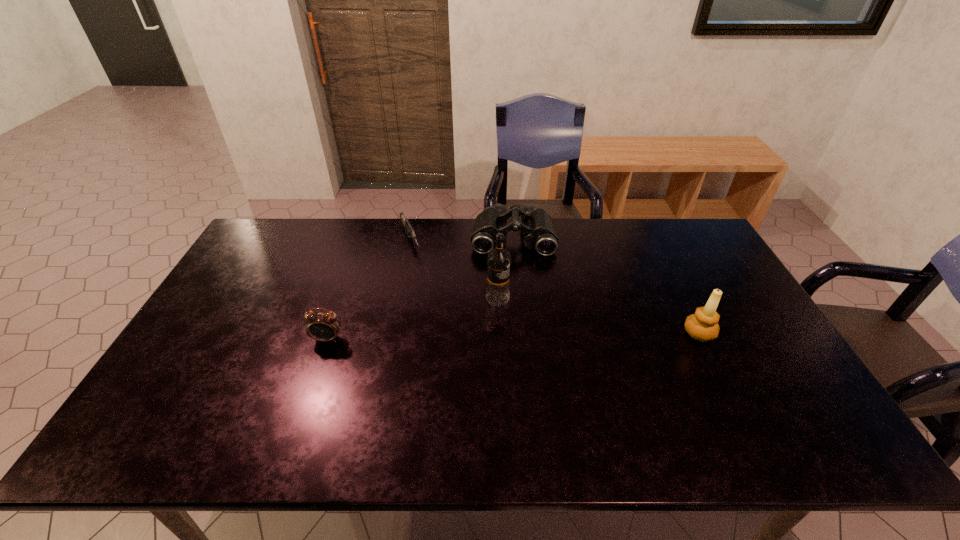
The image size is (960, 540). Identify the location of free space on the desktop that is between the alarm clock and the fourth shortest object and is positioned on the label of the vodka. (559, 335).

Where is `free space on the desktop that is between the leftmost object and the fourth shortest object and is positioned on the front-facing side of the binoculars`? The height and width of the screenshot is (540, 960). free space on the desktop that is between the leftmost object and the fourth shortest object and is positioned on the front-facing side of the binoculars is located at coordinates pyautogui.click(x=515, y=336).

Where is `vacant space on the desktop that is between the alarm clock and the candle_holder and is positioned aimed along the barrel of the gun`? The image size is (960, 540). vacant space on the desktop that is between the alarm clock and the candle_holder and is positioned aimed along the barrel of the gun is located at coordinates (465, 337).